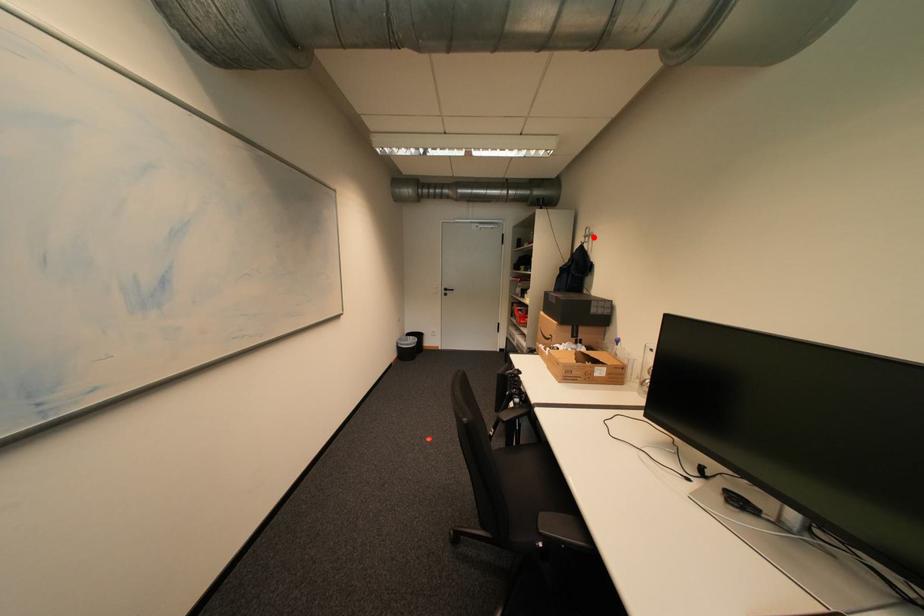
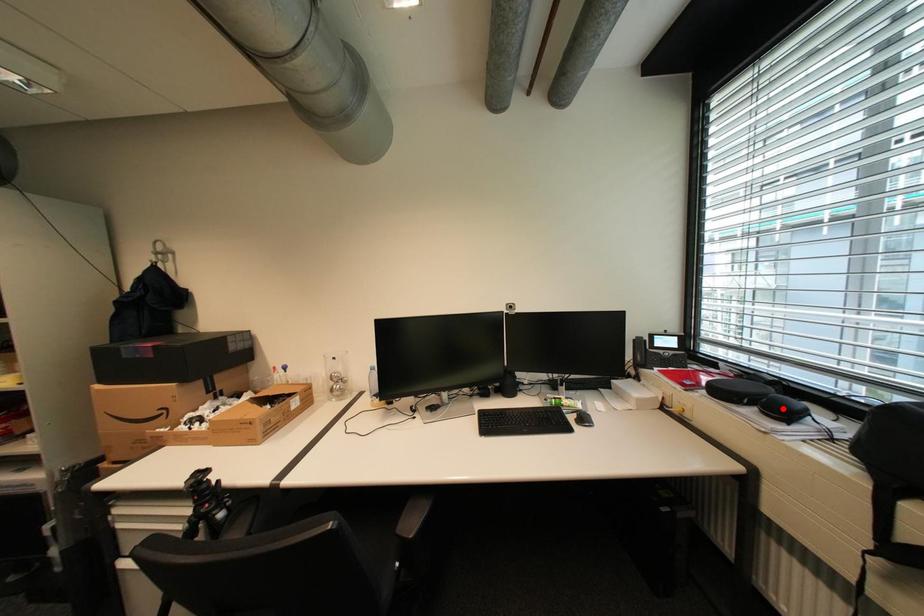
I am providing you with two images of the same scene from different viewpoints. A red point is marked on the first image and another point is marked on the second image. Is the marked point in image1 the same physical position as the marked point in image2?

No